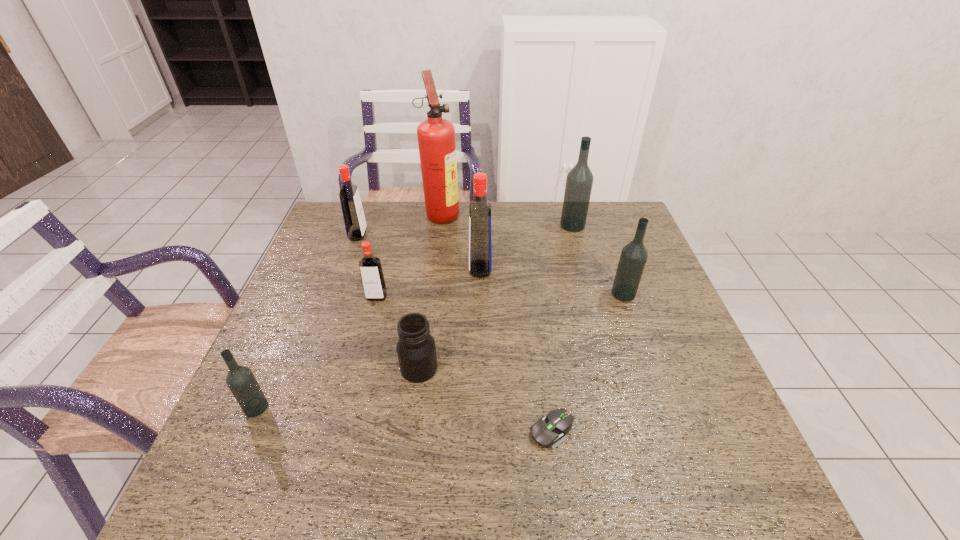
This screenshot has height=540, width=960. I want to click on the nearest red vodka, so click(370, 267).

The width and height of the screenshot is (960, 540). Identify the location of the smallest red vodka. (370, 267).

This screenshot has width=960, height=540. In order to click on the leftmost vodka in this screenshot , I will do `click(241, 381)`.

This screenshot has height=540, width=960. I want to click on the nearest vodka, so click(x=241, y=381).

What are the coordinates of `jar` in the screenshot? It's located at (416, 349).

Find the location of a particular element. This screenshot has width=960, height=540. the seventh farthest object is located at coordinates (416, 349).

This screenshot has width=960, height=540. In order to click on the shortest object in this screenshot , I will do `click(548, 431)`.

I want to click on computer mouse, so click(x=548, y=431).

Where is `vacant area situated on the front-facing side of the tallest object`? vacant area situated on the front-facing side of the tallest object is located at coordinates (574, 213).

This screenshot has height=540, width=960. What are the coordinates of `free space located 0.290m on the front of the fifth vodka from left to right` in the screenshot? It's located at (591, 294).